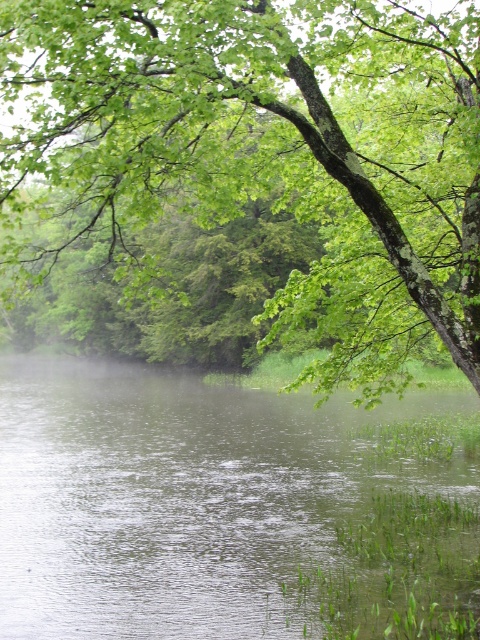
Based on the scene description, where is the green leafy tree at upper center located in the image?

The green leafy tree at upper center is located at point coordinates of (274, 147).

Consider the image. You are standing at the edge of the pond and want to take a photo of both the green leafy tree at upper center and the clear water at center. Which object will appear closer to the camera in your photo?

The green leafy tree at upper center will appear closer to the camera in the photo because it is positioned in front of the clear water at center.